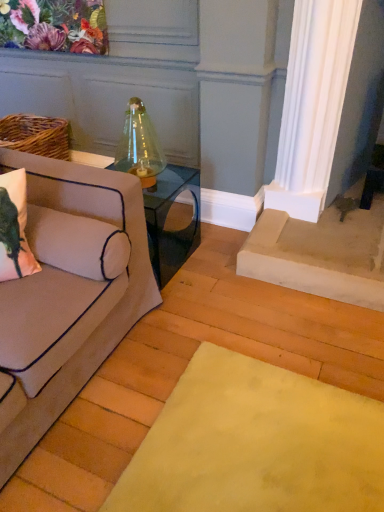
Locate an element on the screen. spots to the right of beige fabric couch at left is located at coordinates (220, 362).